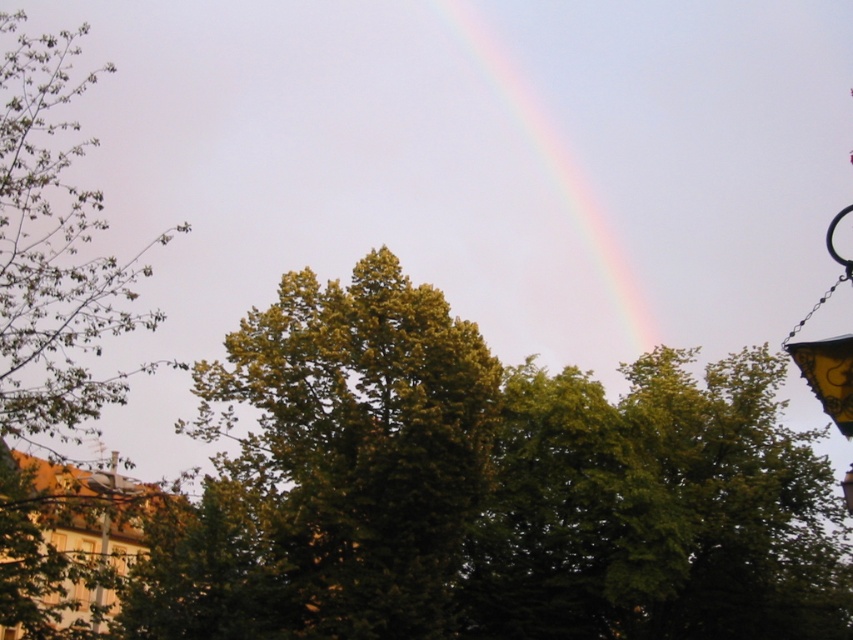
You are a painter setting up your easel to capture the scene of the rainbow. You want to ensure that the green leafy tree at center and the metallic pole at lower left are both visible in your painting. Given their widths, which object should you place closer to the edge of your canvas to avoid overcrowding?

The green leafy tree at center has a greater width than the metallic pole at lower left, so you should place the green leafy tree at center closer to the edge of your canvas to prevent overcrowding and maintain balance in the composition.

You are an artist trying to paint the scene. You notice the green leafy tree at center and the rainbow at upper center. Which one do you think is shorter in height?

The green leafy tree at center is not as tall as the rainbow at upper center, so the green leafy tree at center is shorter in height.